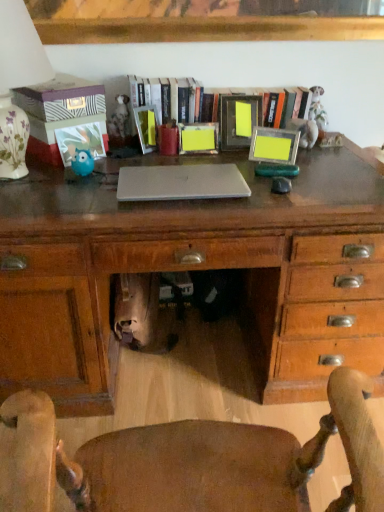
I want to click on vacant space to the right of porcelain floral table lamp at upper left, so click(x=99, y=181).